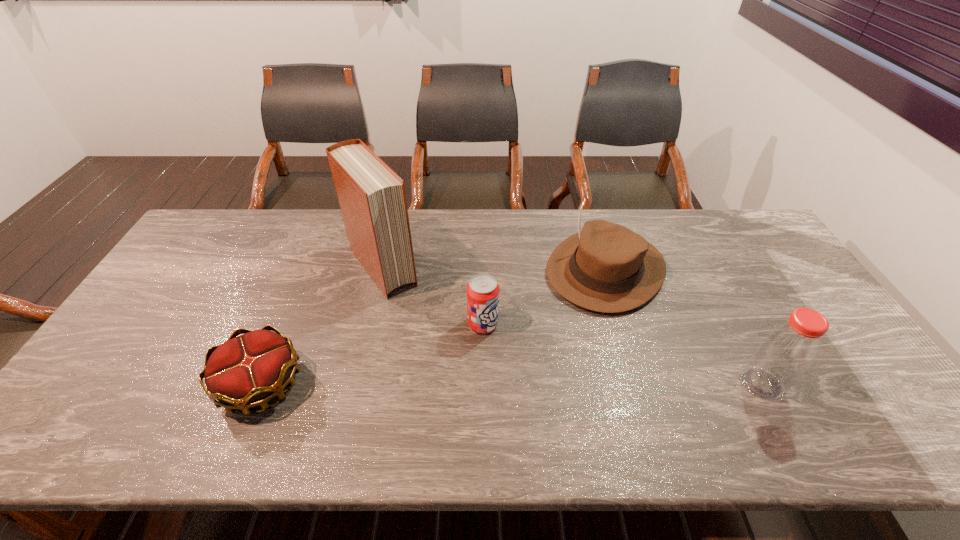
In order to click on the shortest object in this screenshot , I will do `click(246, 371)`.

The image size is (960, 540). Identify the location of crown. (246, 371).

In order to click on the second tallest object in this screenshot , I will do `click(786, 352)`.

Locate an element on the screen. The width and height of the screenshot is (960, 540). bottle is located at coordinates (786, 352).

The image size is (960, 540). Identify the location of hardback book. (372, 198).

At what (x,y) coordinates should I click in order to perform the action: click on the tallest object. Please return your answer as a coordinate pair (x, y). Looking at the image, I should click on [x=372, y=198].

You are a GUI agent. You are given a task and a screenshot of the screen. Output one action in this format:
    pyautogui.click(x=<x>, y=<y>)
    Task: Click on the third object from right to left
    This screenshot has height=540, width=960.
    Given the screenshot: What is the action you would take?
    pyautogui.click(x=483, y=291)

The width and height of the screenshot is (960, 540). Identify the location of soda can. (483, 291).

Where is `the third tallest object`? This screenshot has height=540, width=960. the third tallest object is located at coordinates (606, 267).

You are a GUI agent. You are given a task and a screenshot of the screen. Output one action in this format:
    pyautogui.click(x=<x>, y=<y>)
    Task: Click on the fedora
    The image size is (960, 540).
    Given the screenshot: What is the action you would take?
    pyautogui.click(x=606, y=267)